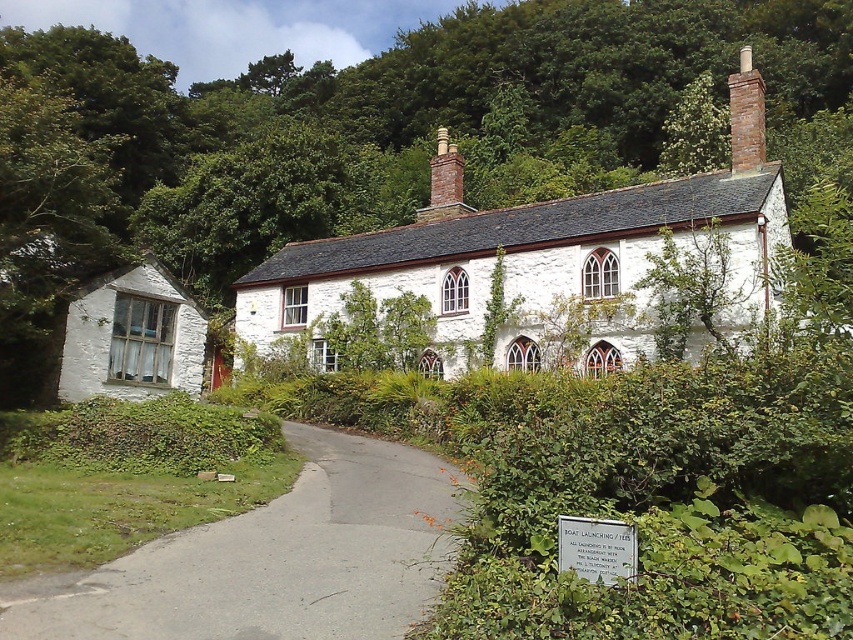
Is white matte cottage at left closer to camera compared to brown brick chimney at upper right?

Yes.

You are a GUI agent. You are given a task and a screenshot of the screen. Output one action in this format:
    pyautogui.click(x=<x>, y=<y>)
    Task: Click on the white matte cottage at left
    The height and width of the screenshot is (640, 853).
    Given the screenshot: What is the action you would take?
    pyautogui.click(x=132, y=337)

Where is `white matte cottage at left`? The height and width of the screenshot is (640, 853). white matte cottage at left is located at coordinates (132, 337).

Does white stone cottage at center have a greater height compared to white matte cottage at left?

Yes.

Can you confirm if white stone cottage at center is smaller than white matte cottage at left?

No, white stone cottage at center is not smaller than white matte cottage at left.

Between point (741, 300) and point (161, 337), which one is positioned in front?

Positioned in front is point (741, 300).

Where is `white stone cottage at center`? white stone cottage at center is located at coordinates (514, 257).

Who is shorter, white stone cottage at center or gray asphalt driveway at lower center?

gray asphalt driveway at lower center is shorter.

Can you confirm if white stone cottage at center is wider than gray asphalt driveway at lower center?

Indeed, white stone cottage at center has a greater width compared to gray asphalt driveway at lower center.

Is point (262, 282) closer to camera compared to point (323, 433)?

No.

The height and width of the screenshot is (640, 853). Identify the location of white stone cottage at center. (514, 257).